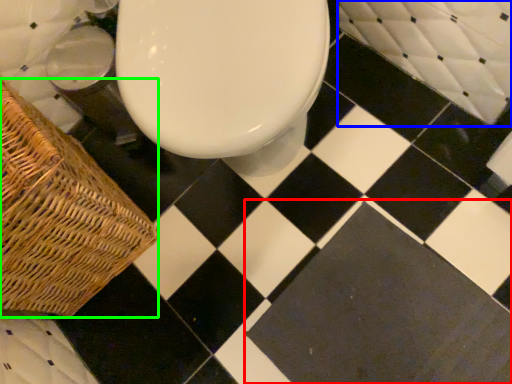
Question: Which object is positioned closest to square (highlighted by a red box)? Select from bath (highlighted by a blue box) and picnic basket (highlighted by a green box).

Choices:
 (A) bath
 (B) picnic basket

Answer: (A)